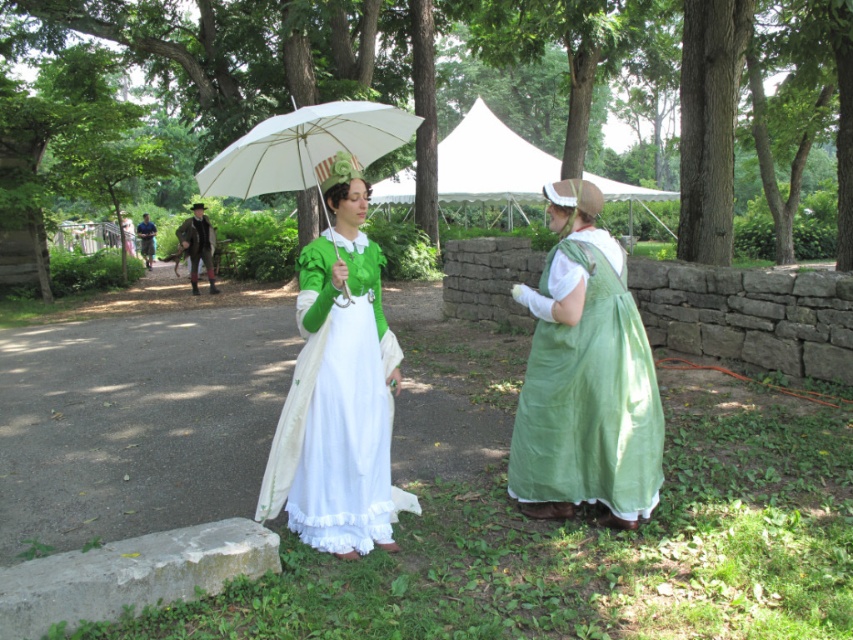
Question: Does white satin dress at center have a smaller size compared to green satin dress at center?

Choices:
 (A) no
 (B) yes

Answer: (B)

Question: Which of the following is the farthest from the observer?

Choices:
 (A) white matte umbrella at center
 (B) white canvas canopy at center

Answer: (B)

Question: Is white matte umbrella at center to the right of green satin dress at center from the viewer's perspective?

Choices:
 (A) no
 (B) yes

Answer: (B)

Question: Which of the following is the closest to the observer?

Choices:
 (A) (550, 186)
 (B) (335, 296)
 (C) (651, 406)
 (D) (199, 241)

Answer: (B)

Question: Which point is closer to the camera?

Choices:
 (A) green satin dress at center
 (B) white satin dress at center

Answer: (B)

Question: Does green satin dress at right have a lesser width compared to white satin dress at center?

Choices:
 (A) yes
 (B) no

Answer: (A)